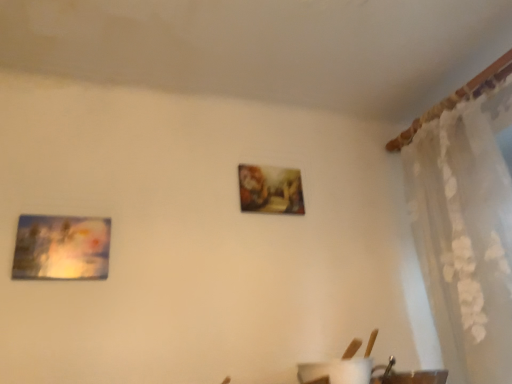
This screenshot has width=512, height=384. What do you see at coordinates (466, 233) in the screenshot?
I see `white sheer curtain at upper right` at bounding box center [466, 233].

At what (x,y) coordinates should I click in order to perform the action: click on white sheer curtain at upper right. Please return your answer as a coordinate pair (x, y). Looking at the image, I should click on (466, 233).

In order to face white sheer curtain at upper right, should I rotate leftwards or rightwards?

You should look right and rotate roughly 27.336 degrees.

This screenshot has height=384, width=512. What do you see at coordinates (61, 248) in the screenshot? I see `matte plastic picture frame at left` at bounding box center [61, 248].

Where is `matte plastic picture frame at left`? The width and height of the screenshot is (512, 384). matte plastic picture frame at left is located at coordinates (61, 248).

Identify the location of white sheer curtain at upper right. (466, 233).

Is white sheer curtain at upper right to the left or to the right of matte plastic picture frame at left in the image?

Clearly, white sheer curtain at upper right is on the right of matte plastic picture frame at left in the image.

Considering the relative positions of white sheer curtain at upper right and matte plastic picture frame at left in the image provided, is white sheer curtain at upper right behind matte plastic picture frame at left?

No, the depth of white sheer curtain at upper right is less than that of matte plastic picture frame at left.

Does point (490, 296) come closer to viewer compared to point (97, 228)?

Yes.

From the image's perspective, is white sheer curtain at upper right beneath matte plastic picture frame at left?

No, from the image's perspective, white sheer curtain at upper right is not beneath matte plastic picture frame at left.

From a real-world perspective, who is located higher, white sheer curtain at upper right or matte plastic picture frame at left?

In real-world perspective, matte plastic picture frame at left is above.

Does white sheer curtain at upper right have a greater width compared to matte plastic picture frame at left?

Yes.

Considering the relative sizes of white sheer curtain at upper right and matte plastic picture frame at left in the image provided, is white sheer curtain at upper right shorter than matte plastic picture frame at left?

In fact, white sheer curtain at upper right may be taller than matte plastic picture frame at left.

Looking at the image, does white sheer curtain at upper right seem bigger or smaller compared to matte plastic picture frame at left?

Clearly, white sheer curtain at upper right is larger in size than matte plastic picture frame at left.

Would you say white sheer curtain at upper right is outside matte plastic picture frame at left?

Yes, white sheer curtain at upper right is located beyond the bounds of matte plastic picture frame at left.

Are white sheer curtain at upper right and matte plastic picture frame at left making contact?

No, white sheer curtain at upper right is not touching matte plastic picture frame at left.

Does white sheer curtain at upper right turn towards matte plastic picture frame at left?

Yes, white sheer curtain at upper right is facing matte plastic picture frame at left.

How different are the orientations of white sheer curtain at upper right and matte plastic picture frame at left in degrees?

The angle between the facing direction of white sheer curtain at upper right and the facing direction of matte plastic picture frame at left is 89.8 degrees.

This screenshot has height=384, width=512. I want to click on curtain below the matte plastic picture frame at left (from a real-world perspective), so click(466, 233).

Considering the relative positions of matte plastic picture frame at left and white sheer curtain at upper right in the image provided, is matte plastic picture frame at left to the left or to the right of white sheer curtain at upper right?

In the image, matte plastic picture frame at left appears on the left side of white sheer curtain at upper right.

Between matte plastic picture frame at left and white sheer curtain at upper right, which one is positioned behind?

matte plastic picture frame at left is further away from the camera.

Considering the points (105, 247) and (461, 181), which point is behind, point (105, 247) or point (461, 181)?

The point (461, 181) is behind.

From the image's perspective, is matte plastic picture frame at left over white sheer curtain at upper right?

No, from the image's perspective, matte plastic picture frame at left is not over white sheer curtain at upper right.

From a real-world perspective, does matte plastic picture frame at left sit lower than white sheer curtain at upper right?

Actually, matte plastic picture frame at left is physically above white sheer curtain at upper right in the real world.

Is matte plastic picture frame at left wider than white sheer curtain at upper right?

Incorrect, the width of matte plastic picture frame at left does not surpass that of white sheer curtain at upper right.

Is matte plastic picture frame at left taller than white sheer curtain at upper right?

No, matte plastic picture frame at left is not taller than white sheer curtain at upper right.

Is matte plastic picture frame at left bigger or smaller than white sheer curtain at upper right?

matte plastic picture frame at left is smaller than white sheer curtain at upper right.

Choose the correct answer: Is matte plastic picture frame at left inside white sheer curtain at upper right or outside it?

matte plastic picture frame at left lies outside white sheer curtain at upper right.

Is the surface of matte plastic picture frame at left in direct contact with white sheer curtain at upper right?

matte plastic picture frame at left and white sheer curtain at upper right are not in contact.

Is matte plastic picture frame at left oriented away from white sheer curtain at upper right?

That's not correct — matte plastic picture frame at left is not looking away from white sheer curtain at upper right.

Image resolution: width=512 pixels, height=384 pixels. I want to click on picture frame that appears above the white sheer curtain at upper right (from a real-world perspective), so click(61, 248).

Where is `picture frame below the white sheer curtain at upper right (from the image's perspective)`? The height and width of the screenshot is (384, 512). picture frame below the white sheer curtain at upper right (from the image's perspective) is located at coordinates (61, 248).

The width and height of the screenshot is (512, 384). Identify the location of picture frame above the white sheer curtain at upper right (from a real-world perspective). (61, 248).